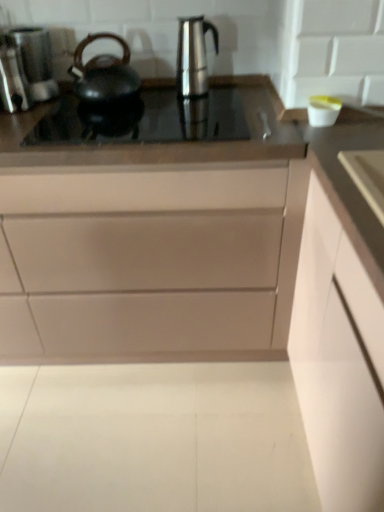
Locate an element on the screen. This screenshot has height=512, width=384. spots to the right of stainless steel coffee pot at center is located at coordinates (251, 98).